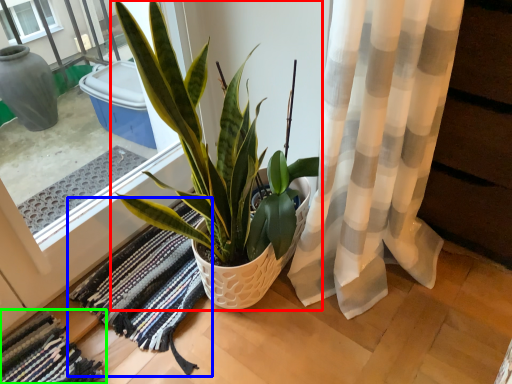
Question: Based on their relative distances, which object is nearer to houseplant (highlighted by a red box)? Choose from bath mat (highlighted by a blue box) and bath mat (highlighted by a green box).

Choices:
 (A) bath mat
 (B) bath mat

Answer: (A)